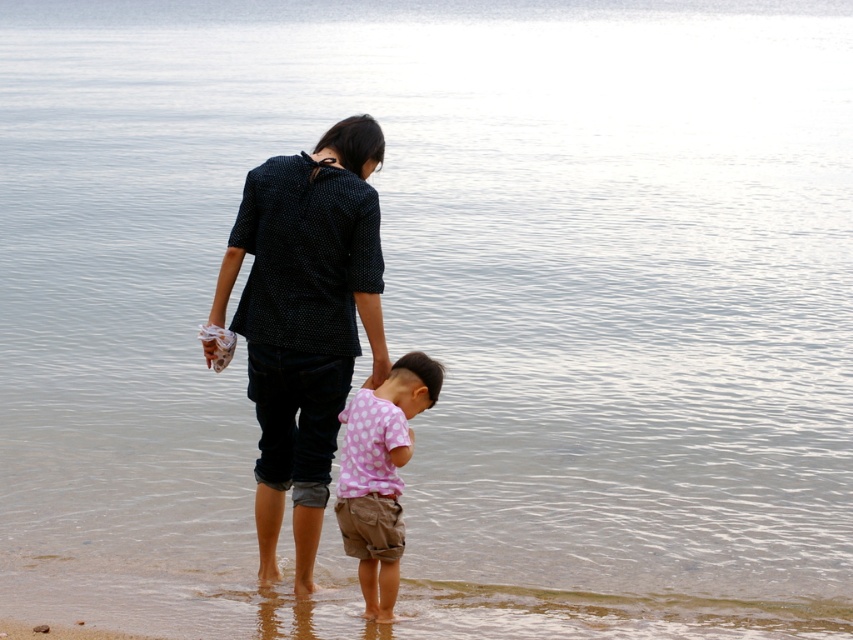
Question: Observing the image, what is the correct spatial positioning of black dotted shirt at center in reference to pink dotted shirt at lower center?

Choices:
 (A) left
 (B) right

Answer: (A)

Question: Which of the following is the farthest from the observer?

Choices:
 (A) black dotted shirt at center
 (B) pink dotted shirt at lower center

Answer: (A)

Question: In this image, where is black dotted shirt at center located relative to pink dotted shirt at lower center?

Choices:
 (A) above
 (B) below

Answer: (A)

Question: Where is black dotted shirt at center located in relation to pink dotted shirt at lower center in the image?

Choices:
 (A) below
 (B) above

Answer: (B)